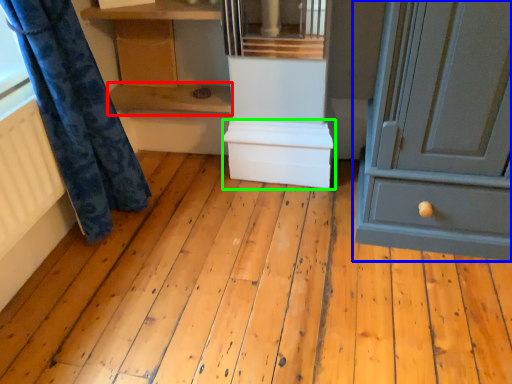
Question: Estimate the real-world distances between objects in this image. Which object is closer to shelf (highlighted by a red box), chest of drawers (highlighted by a blue box) or cabinetry (highlighted by a green box)?

Choices:
 (A) chest of drawers
 (B) cabinetry

Answer: (B)